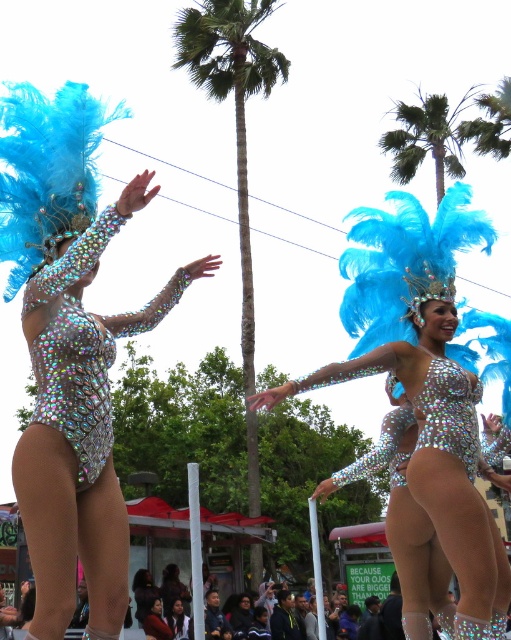
You are a photographer trying to capture both the holographic sequin bodysuit at center and the matte black jacket at lower center in a single frame. Based on their positions and sizes, which object should you focus on first to ensure both are in the frame?

Since the holographic sequin bodysuit at center might be wider than the matte black jacket at lower center, you should focus on the holographic sequin bodysuit at center first to ensure both fit within the frame.

You are a photographer trying to capture a clear shot of both the holographic sequin bodysuit at center and the green textured palm tree at center. Which object should you focus on first to ensure both are in focus?

You should focus on the holographic sequin bodysuit at center first since it is closer to the viewer than the green textured palm tree at center. By focusing on the closer object, the depth of field may also keep the farther object in acceptable focus.